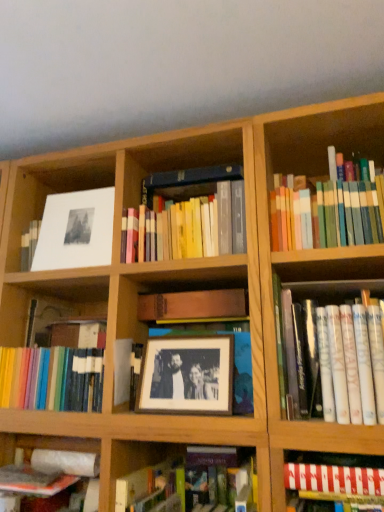
Question: Can you confirm if wooden frame at center is smaller than white matte picture frame at upper left, which ranks as the first picture frame in top-to-bottom order?

Choices:
 (A) yes
 (B) no

Answer: (B)

Question: From a real-world perspective, does wooden frame at center sit lower than white matte picture frame at upper left, which ranks as the first picture frame in top-to-bottom order?

Choices:
 (A) yes
 (B) no

Answer: (A)

Question: From the image's perspective, is wooden frame at center below white matte picture frame at upper left, positioned as the 2th picture frame in front-to-back order?

Choices:
 (A) yes
 (B) no

Answer: (A)

Question: Is wooden frame at center at the left side of white matte picture frame at upper left, the first picture frame from the left?

Choices:
 (A) no
 (B) yes

Answer: (A)

Question: Does wooden frame at center have a greater width compared to white matte picture frame at upper left, placed as the 2th picture frame when sorted from right to left?

Choices:
 (A) yes
 (B) no

Answer: (A)

Question: Is wooden frame at center at the right side of white matte picture frame at upper left, which ranks as the first picture frame in top-to-bottom order?

Choices:
 (A) no
 (B) yes

Answer: (B)

Question: Is wooden picture frame at center, the second picture frame viewed from the left, smaller than hardcover book at lower center, the second book in the bottom-to-top sequence?

Choices:
 (A) no
 (B) yes

Answer: (B)

Question: Are wooden picture frame at center, the 1th picture frame ordered from the bottom, and hardcover book at lower center, placed as the sixth book when sorted from top to bottom, making contact?

Choices:
 (A) yes
 (B) no

Answer: (B)

Question: Considering the relative sizes of wooden picture frame at center, the 2th picture frame from the top, and hardcover book at lower center, placed as the sixth book when sorted from top to bottom, in the image provided, is wooden picture frame at center, the 2th picture frame from the top, shorter than hardcover book at lower center, placed as the sixth book when sorted from top to bottom,?

Choices:
 (A) yes
 (B) no

Answer: (B)

Question: Is wooden picture frame at center, the 2th picture frame from the top, positioned far away from hardcover book at lower center, the second book in the bottom-to-top sequence?

Choices:
 (A) no
 (B) yes

Answer: (A)

Question: From a real-world perspective, is wooden picture frame at center, positioned as the 1th picture frame in right-to-left order, physically below hardcover book at lower center, the second book in the bottom-to-top sequence?

Choices:
 (A) yes
 (B) no

Answer: (B)

Question: From the image's perspective, is wooden picture frame at center, the 2th picture frame from the top, under hardcover book at lower center, placed as the sixth book when sorted from top to bottom?

Choices:
 (A) no
 (B) yes

Answer: (A)

Question: Does hardcover books at center, the second book viewed from the top, come in front of hardcover book at lower center, the second book in the bottom-to-top sequence?

Choices:
 (A) no
 (B) yes

Answer: (A)